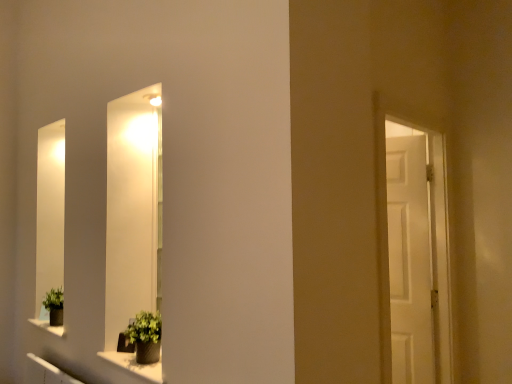
This screenshot has height=384, width=512. Describe the element at coordinates (54, 305) in the screenshot. I see `green matte plant at lower left, which is counted as the first houseplant, starting from the left` at that location.

This screenshot has width=512, height=384. I want to click on white wooden door at right, so click(416, 251).

Can you confirm if green matte plant pot at lower left, positioned as the 2th houseplant in back-to-front order, is positioned to the left of green matte plant at lower left, the second houseplant viewed from the right?

No, green matte plant pot at lower left, positioned as the 2th houseplant in back-to-front order, is not to the left of green matte plant at lower left, the second houseplant viewed from the right.

From the image's perspective, is green matte plant pot at lower left, the 2th houseplant when ordered from left to right, located above or below green matte plant at lower left, the 1th houseplant when ordered from back to front?

From the image's perspective, green matte plant pot at lower left, the 2th houseplant when ordered from left to right, appears above green matte plant at lower left, the 1th houseplant when ordered from back to front.

Locate an element on the screen. houseplant below the green matte plant pot at lower left, which ranks as the 1th houseplant in right-to-left order (from the image's perspective) is located at coordinates (54, 305).

Can you confirm if green matte plant pot at lower left, arranged as the 1th houseplant when viewed from the front, is wider than green matte plant at lower left, the second houseplant viewed from the right?

In fact, green matte plant pot at lower left, arranged as the 1th houseplant when viewed from the front, might be narrower than green matte plant at lower left, the second houseplant viewed from the right.

In the image, is white wooden door at right positioned in front of or behind green matte plant pot at lower left, arranged as the 1th houseplant when viewed from the front?

In the image, white wooden door at right appears in front of green matte plant pot at lower left, arranged as the 1th houseplant when viewed from the front.

Can you confirm if white wooden door at right is bigger than green matte plant pot at lower left, the 2th houseplant when ordered from left to right?

Correct, white wooden door at right is larger in size than green matte plant pot at lower left, the 2th houseplant when ordered from left to right.

Does white wooden door at right appear on the left side of green matte plant pot at lower left, arranged as the 1th houseplant when viewed from the front?

No, white wooden door at right is not to the left of green matte plant pot at lower left, arranged as the 1th houseplant when viewed from the front.

Is white wooden door at right shorter than green matte plant pot at lower left, the 2th houseplant when ordered from left to right?

In fact, white wooden door at right may be taller than green matte plant pot at lower left, the 2th houseplant when ordered from left to right.

Considering the sizes of objects white wooden door at right and green matte plant at lower left, the second houseplant viewed from the right, in the image provided, who is taller, white wooden door at right or green matte plant at lower left, the second houseplant viewed from the right,?

white wooden door at right.

Could you measure the distance between white wooden door at right and green matte plant at lower left, the second houseplant viewed from the right?

white wooden door at right and green matte plant at lower left, the second houseplant viewed from the right, are 2.08 meters apart from each other.

Is white wooden door at right far from green matte plant at lower left, the second houseplant viewed from the right?

Yes.

From the image's perspective, is white wooden door at right on green matte plant at lower left, which is counted as the first houseplant, starting from the left?

Yes, from the image's perspective, white wooden door at right is above green matte plant at lower left, which is counted as the first houseplant, starting from the left.

Is matte gray stone window sill at lower center directly adjacent to green matte plant at lower left, the 1th houseplant when ordered from back to front?

No, matte gray stone window sill at lower center is not with green matte plant at lower left, the 1th houseplant when ordered from back to front.

Is matte gray stone window sill at lower center located outside green matte plant at lower left, the second houseplant viewed from the right?

Yes, matte gray stone window sill at lower center is outside of green matte plant at lower left, the second houseplant viewed from the right.

Considering the points (141, 376) and (57, 311), which point is behind, point (141, 376) or point (57, 311)?

Point (57, 311)

Is matte gray stone window sill at lower center shorter than green matte plant at lower left, the second houseplant viewed from the right?

Correct, matte gray stone window sill at lower center is not as tall as green matte plant at lower left, the second houseplant viewed from the right.

Which of these two, green matte plant pot at lower left, arranged as the 1th houseplant when viewed from the front, or matte gray stone window sill at lower center, is bigger?

green matte plant pot at lower left, arranged as the 1th houseplant when viewed from the front.

Consider the image. Considering the positions of objects green matte plant pot at lower left, the 2th houseplant when ordered from left to right, and matte gray stone window sill at lower center in the image provided, who is more to the right, green matte plant pot at lower left, the 2th houseplant when ordered from left to right, or matte gray stone window sill at lower center?

From the viewer's perspective, matte gray stone window sill at lower center appears more on the right side.

Based on the photo, would you say green matte plant pot at lower left, positioned as the 2th houseplant in back-to-front order, contains matte gray stone window sill at lower center?

No, matte gray stone window sill at lower center is located outside of green matte plant pot at lower left, positioned as the 2th houseplant in back-to-front order.

Which of these two, green matte plant pot at lower left, the 2th houseplant when ordered from left to right, or matte gray stone window sill at lower center, is wider?

green matte plant pot at lower left, the 2th houseplant when ordered from left to right.

At what (x,y) coordinates should I click in order to perform the action: click on door lying above the green matte plant at lower left, arranged as the 2th houseplant when viewed from the front (from the image's perspective). Please return your answer as a coordinate pair (x, y). Looking at the image, I should click on (416, 251).

From a real-world perspective, is green matte plant at lower left, arranged as the 2th houseplant when viewed from the front, physically above white wooden door at right?

No, from a real-world perspective, green matte plant at lower left, arranged as the 2th houseplant when viewed from the front, is not on top of white wooden door at right.

Which is more distant, (57, 315) or (445, 334)?

The point (445, 334) is more distant.

Measure the distance from green matte plant at lower left, the 1th houseplant when ordered from back to front, to white wooden door at right.

green matte plant at lower left, the 1th houseplant when ordered from back to front, and white wooden door at right are 6.82 feet apart from each other.

In terms of size, does green matte plant at lower left, which is counted as the first houseplant, starting from the left, appear bigger or smaller than matte gray stone window sill at lower center?

green matte plant at lower left, which is counted as the first houseplant, starting from the left, is bigger than matte gray stone window sill at lower center.

From the image's perspective, which one is positioned higher, green matte plant at lower left, which is counted as the first houseplant, starting from the left, or matte gray stone window sill at lower center?

green matte plant at lower left, which is counted as the first houseplant, starting from the left, appears higher in the image.

From a real-world perspective, is green matte plant at lower left, the 1th houseplant when ordered from back to front, on top of matte gray stone window sill at lower center?

Indeed, from a real-world perspective, green matte plant at lower left, the 1th houseplant when ordered from back to front, stands above matte gray stone window sill at lower center.

At what (x,y) coordinates should I click in order to perform the action: click on houseplant on the right of green matte plant at lower left, the 1th houseplant when ordered from back to front. Please return your answer as a coordinate pair (x, y). Looking at the image, I should click on (145, 336).

The image size is (512, 384). Find the location of `door that appears above the green matte plant pot at lower left, arranged as the 1th houseplant when viewed from the front (from the image's perspective)`. door that appears above the green matte plant pot at lower left, arranged as the 1th houseplant when viewed from the front (from the image's perspective) is located at coordinates (416, 251).

Looking at the image, which one is located closer to white wooden door at right, matte gray stone window sill at lower center or green matte plant at lower left, arranged as the 2th houseplant when viewed from the front?

Among the two, matte gray stone window sill at lower center is located nearer to white wooden door at right.

Looking at the image, which one is located closer to green matte plant at lower left, the 1th houseplant when ordered from back to front, green matte plant pot at lower left, positioned as the 2th houseplant in back-to-front order, or matte gray stone window sill at lower center?

Based on the image, matte gray stone window sill at lower center appears to be nearer to green matte plant at lower left, the 1th houseplant when ordered from back to front.

Looking at this image, when comparing their distances from matte gray stone window sill at lower center, does white wooden door at right or green matte plant pot at lower left, which ranks as the 1th houseplant in right-to-left order, seem closer?

green matte plant pot at lower left, which ranks as the 1th houseplant in right-to-left order, lies closer to matte gray stone window sill at lower center than the other object.

Considering their positions, is white wooden door at right positioned closer to matte gray stone window sill at lower center than green matte plant at lower left, the second houseplant viewed from the right?

Based on the image, green matte plant at lower left, the second houseplant viewed from the right, appears to be nearer to matte gray stone window sill at lower center.

Looking at the image, which one is located further to green matte plant at lower left, the second houseplant viewed from the right, white wooden door at right or matte gray stone window sill at lower center?

The object further to green matte plant at lower left, the second houseplant viewed from the right, is white wooden door at right.

Based on their spatial positions, is green matte plant at lower left, arranged as the 2th houseplant when viewed from the front, or green matte plant pot at lower left, which ranks as the 1th houseplant in right-to-left order, closer to white wooden door at right?

green matte plant pot at lower left, which ranks as the 1th houseplant in right-to-left order, is closer to white wooden door at right.

From the image, which object appears to be farther from matte gray stone window sill at lower center, green matte plant pot at lower left, arranged as the 1th houseplant when viewed from the front, or green matte plant at lower left, the 1th houseplant when ordered from back to front?

green matte plant at lower left, the 1th houseplant when ordered from back to front, is positioned further to the anchor matte gray stone window sill at lower center.

When comparing their distances from green matte plant at lower left, arranged as the 2th houseplant when viewed from the front, does green matte plant pot at lower left, which ranks as the 1th houseplant in right-to-left order, or white wooden door at right seem further?

white wooden door at right is further to green matte plant at lower left, arranged as the 2th houseplant when viewed from the front.

This screenshot has height=384, width=512. Identify the location of window sill between green matte plant at lower left, which is counted as the first houseplant, starting from the left, and white wooden door at right. (134, 365).

Find the location of a particular element. houseplant positioned between matte gray stone window sill at lower center and green matte plant at lower left, which is counted as the first houseplant, starting from the left, from near to far is located at coordinates (145, 336).

Find the location of `houseplant between green matte plant at lower left, the second houseplant viewed from the right, and white wooden door at right from left to right`. houseplant between green matte plant at lower left, the second houseplant viewed from the right, and white wooden door at right from left to right is located at coordinates (145, 336).

Identify the location of window sill between green matte plant pot at lower left, the 2th houseplant when ordered from left to right, and white wooden door at right. This screenshot has width=512, height=384. coord(134,365).